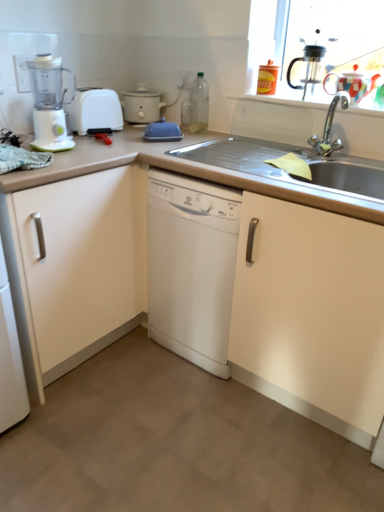
Question: Considering the positions of black plastic coffee machine at upper right and blue rubber dish drainer at center in the image, is black plastic coffee machine at upper right bigger or smaller than blue rubber dish drainer at center?

Choices:
 (A) small
 (B) big

Answer: (B)

Question: Is black plastic coffee machine at upper right inside or outside of blue rubber dish drainer at center?

Choices:
 (A) outside
 (B) inside

Answer: (A)

Question: Estimate the real-world distances between objects in this image. Which object is closer to the matte white cabinet at left?

Choices:
 (A) white plastic blender at left
 (B) white matte slow cooker at upper left
 (C) blue rubber dish drainer at center
 (D) clear plastic bottle at center
 (E) white plastic toaster at left

Answer: (E)

Question: Which object is the farthest from the white plastic toaster at left?

Choices:
 (A) multicolored ceramic tea pot at upper right
 (B) white matte slow cooker at upper left
 (C) white plastic blender at left
 (D) matte white cabinet at left
 (E) clear plastic bottle at center

Answer: (A)